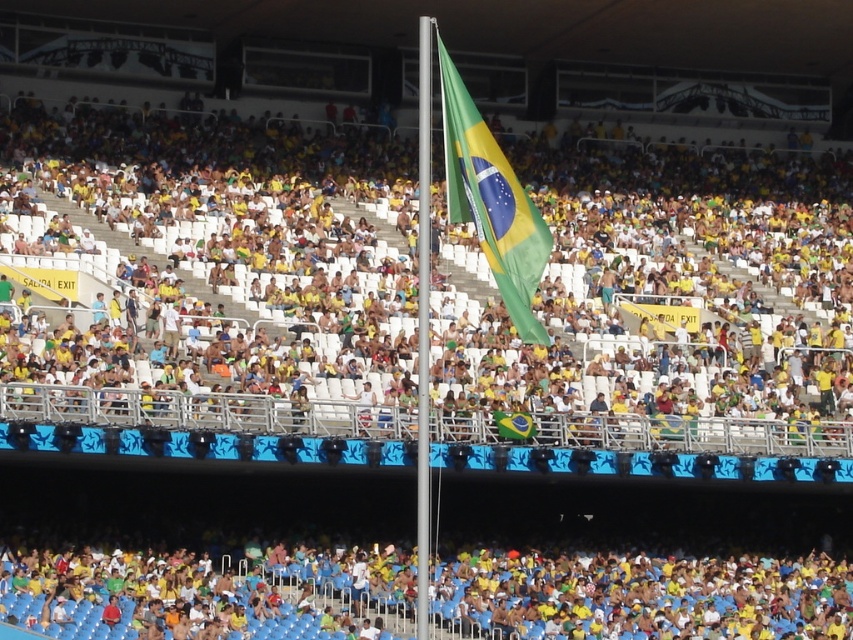
Question: Observing the image, what is the correct spatial positioning of yellow fabric crowd at center in reference to yellow fabric flag at center?

Choices:
 (A) left
 (B) right

Answer: (A)

Question: Based on their relative distances, which object is farther from the yellow fabric flag at center?

Choices:
 (A) green fabric flag at center
 (B) yellow fabric crowd at center

Answer: (A)

Question: Which object appears farthest from the camera in this image?

Choices:
 (A) yellow fabric flag at center
 (B) green fabric flag at center

Answer: (A)

Question: Which object is positioned farthest from the green fabric flag at center?

Choices:
 (A) yellow fabric flag at center
 (B) yellow fabric crowd at center

Answer: (A)

Question: Is yellow fabric crowd at center above yellow fabric flag at center?

Choices:
 (A) yes
 (B) no

Answer: (A)

Question: Is yellow fabric crowd at center bigger than green fabric flag at center?

Choices:
 (A) yes
 (B) no

Answer: (A)